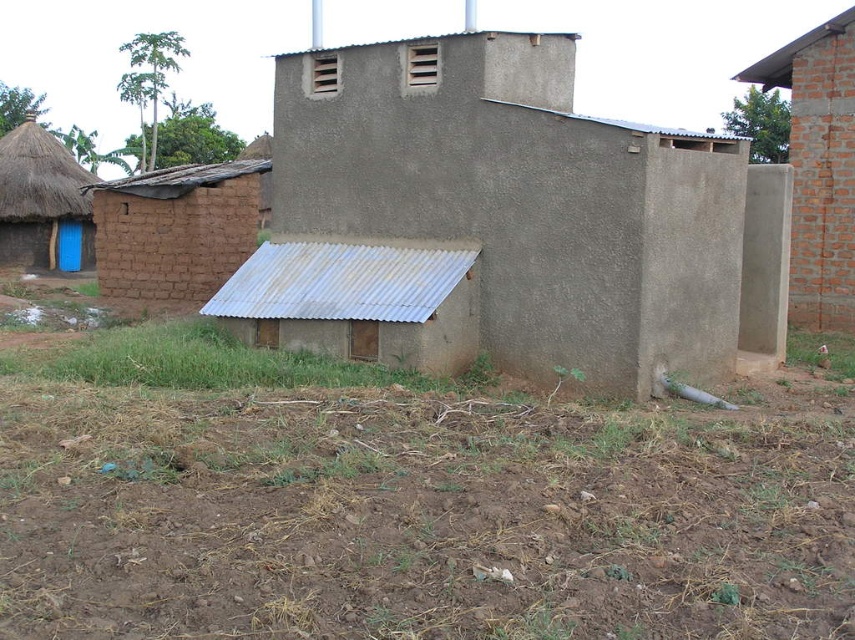
You are a farmer planning to plant crops in the brown soil at lower center. The rusty metal shed at lower center is in the way. Can you determine if the shed is narrower than the soil area so that you can move it aside without losing any planting space?

The brown soil at lower center is wider than the rusty metal shed at lower center, so yes, the shed is narrower than the soil area. You can move it aside without losing any planting space.

You are a visitor standing in front of the rusty metal shed at lower center and the brown mud hut at left. Which structure is taller?

The brown mud hut at left is taller than the rusty metal shed at lower center.

You are a farmer who needs to plant seeds in the brown soil at lower center. However, there is a rusty metal shed at lower center in the way. Can you plant the seeds directly under the shed?

The brown soil at lower center is below the rusty metal shed at lower center, so you cannot plant the seeds directly under the shed because the shed is covering the soil.